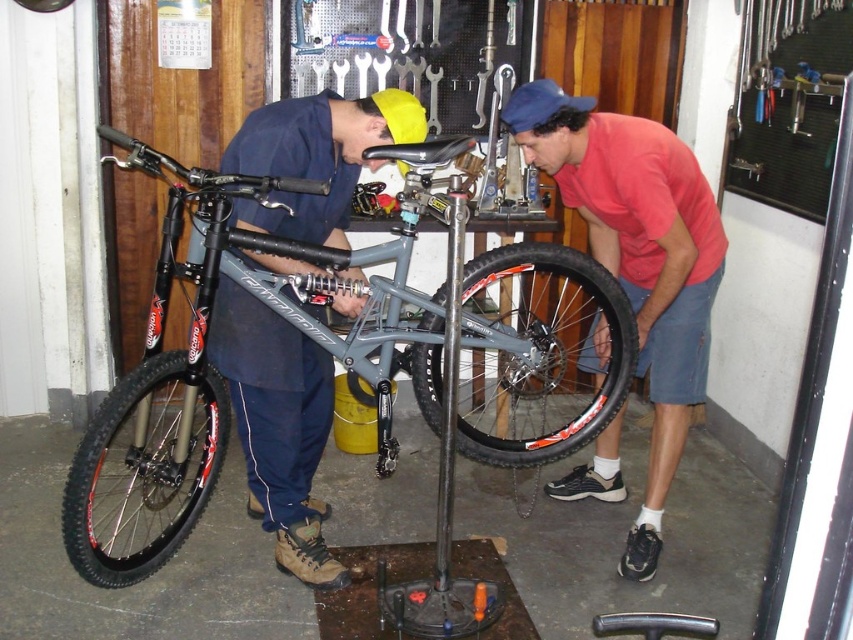
Question: Which point is farther to the camera?

Choices:
 (A) (126, 536)
 (B) (669, 348)
 (C) (483, 380)
 (D) (292, 324)

Answer: (C)

Question: Is red shirt at right to the right of black rubber tire at lower left from the viewer's perspective?

Choices:
 (A) no
 (B) yes

Answer: (B)

Question: Which of the following is the farthest from the observer?

Choices:
 (A) red shirt at right
 (B) black rubber tire at center
 (C) black rubber tire at lower left
 (D) matte blue shirt at center

Answer: (A)

Question: Observing the image, what is the correct spatial positioning of red shirt at right in reference to black rubber tire at center?

Choices:
 (A) above
 (B) below

Answer: (A)

Question: Which object is the farthest from the matte gray bicycle at center?

Choices:
 (A) red shirt at right
 (B) matte blue shirt at center
 (C) black rubber tire at center
 (D) black rubber tire at lower left

Answer: (A)

Question: In this image, where is black rubber tire at center located relative to black rubber tire at lower left?

Choices:
 (A) left
 (B) right

Answer: (B)